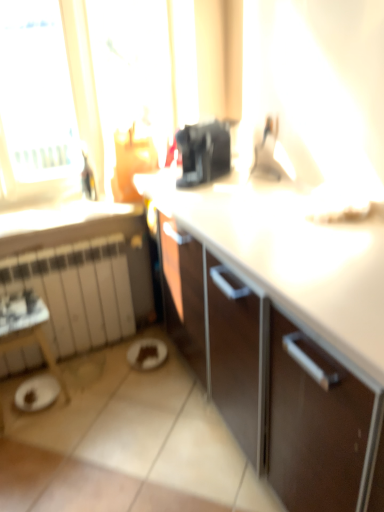
Question: Is point (158, 364) closer or farther from the camera than point (61, 334)?

Choices:
 (A) farther
 (B) closer

Answer: (B)

Question: Relative to white matte radiator at lower left, is brown matte plate at lower center in front or behind?

Choices:
 (A) behind
 (B) front

Answer: (A)

Question: From their relative heights in the image, would you say brown matte plate at lower center is taller or shorter than white matte radiator at lower left?

Choices:
 (A) tall
 (B) short

Answer: (B)

Question: From the image's perspective, is white matte radiator at lower left located above or below brown matte plate at lower center?

Choices:
 (A) below
 (B) above

Answer: (B)

Question: From a real-world perspective, is white matte radiator at lower left physically located above or below brown matte plate at lower center?

Choices:
 (A) above
 (B) below

Answer: (A)

Question: Based on their sizes in the image, would you say white matte radiator at lower left is bigger or smaller than brown matte plate at lower center?

Choices:
 (A) small
 (B) big

Answer: (B)

Question: Does point (44, 293) appear closer or farther from the camera than point (142, 348)?

Choices:
 (A) closer
 (B) farther

Answer: (A)